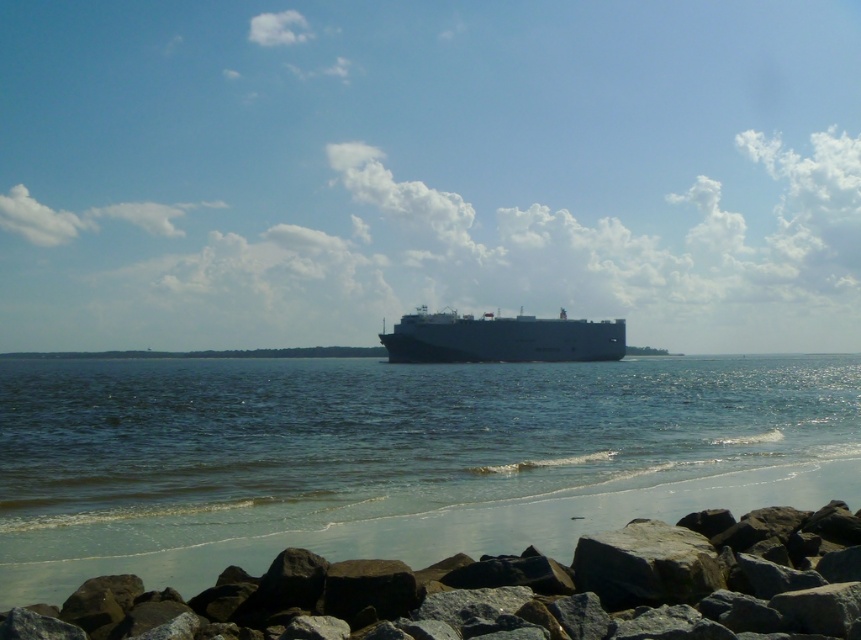
Based on the photo, does blue water at center appear on the left side of white matte cargo ship at center?

Yes, blue water at center is to the left of white matte cargo ship at center.

Can you confirm if blue water at center is positioned above white matte cargo ship at center?

No, blue water at center is not above white matte cargo ship at center.

Is point (847, 355) positioned after point (456, 340)?

That is True.

You are a GUI agent. You are given a task and a screenshot of the screen. Output one action in this format:
    pyautogui.click(x=<x>, y=<y>)
    Task: Click on the blue water at center
    
    Given the screenshot: What is the action you would take?
    pyautogui.click(x=392, y=458)

Can you confirm if blue water at center is positioned to the right of dark gray rock at lower center?

Incorrect, blue water at center is not on the right side of dark gray rock at lower center.

Can you confirm if blue water at center is positioned above dark gray rock at lower center?

No.

At what (x,y) coordinates should I click in order to perform the action: click on blue water at center. Please return your answer as a coordinate pair (x, y). The image size is (861, 640). Looking at the image, I should click on (392, 458).

Find the location of a particular element. Image resolution: width=861 pixels, height=640 pixels. blue water at center is located at coordinates (392, 458).

Is dark gray rock at lower center below white matte cargo ship at center?

Yes, dark gray rock at lower center is below white matte cargo ship at center.

Is dark gray rock at lower center to the right of white matte cargo ship at center from the viewer's perspective?

Incorrect, dark gray rock at lower center is not on the right side of white matte cargo ship at center.

This screenshot has height=640, width=861. Describe the element at coordinates (513, 589) in the screenshot. I see `dark gray rock at lower center` at that location.

What are the coordinates of `dark gray rock at lower center` in the screenshot? It's located at (513, 589).